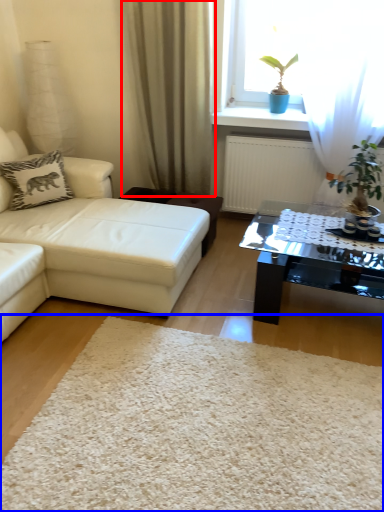
Question: Which object appears farthest to the camera in this image, curtain (highlighted by a red box) or plain (highlighted by a blue box)?

Choices:
 (A) curtain
 (B) plain

Answer: (A)